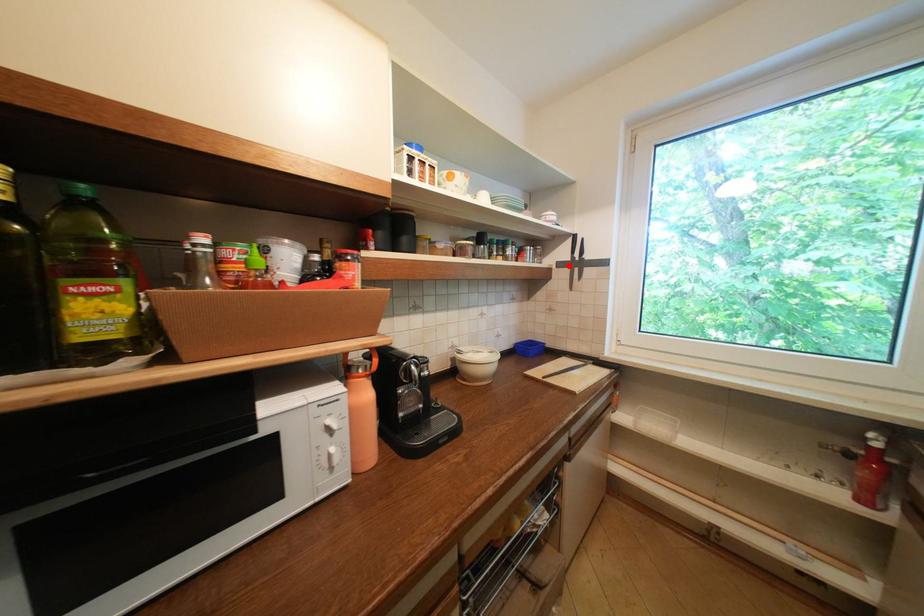
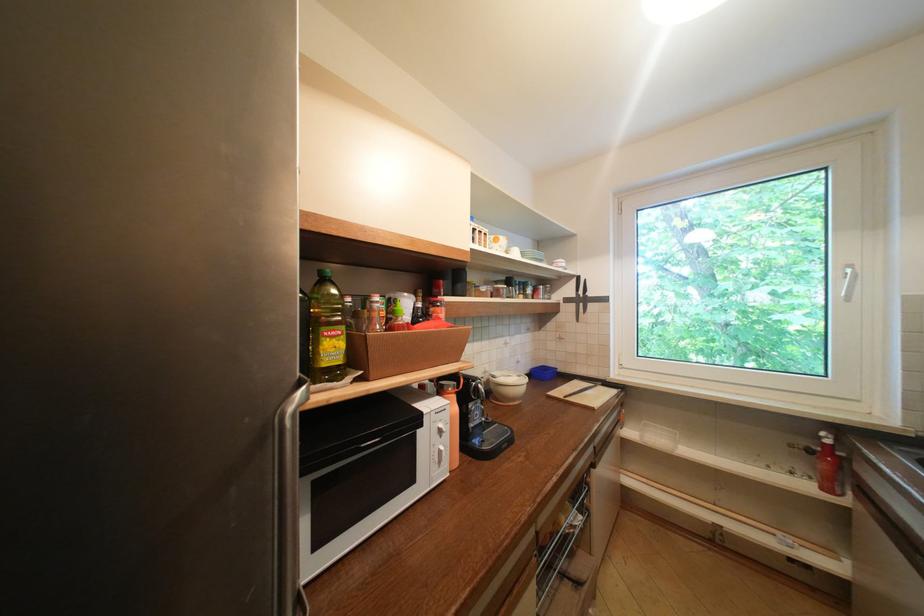
Where in the second image is the point corresponding to the highlighted location from the first image?

(575, 301)